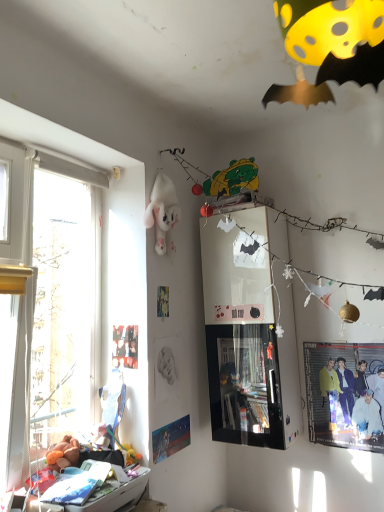
Describe the element at coordinates (64, 454) in the screenshot. This screenshot has height=512, width=384. I see `fluffy orange teddy bear at lower left, the 2th toy viewed from the back` at that location.

Measure the distance between matte black poster at upper left, which is counted as the first poster page, starting from the top, and camera.

matte black poster at upper left, which is counted as the first poster page, starting from the top, and camera are 6.56 feet apart from each other.

This screenshot has height=512, width=384. What do you see at coordinates (362, 399) in the screenshot?
I see `matte yellow jacket at lower right` at bounding box center [362, 399].

What is the approximate height of white plastic drawer at lower left?

7.18 inches.

Locate an element on the screen. The width and height of the screenshot is (384, 512). white plush toy at upper center, the second toy when ordered from left to right is located at coordinates (162, 210).

What do you see at coordinates (162, 210) in the screenshot? The image size is (384, 512). I see `white plush toy at upper center, which appears as the 1th toy when viewed from the top` at bounding box center [162, 210].

The height and width of the screenshot is (512, 384). What are the coordinates of `fluffy orange teddy bear at lower left, the 2th toy viewed from the back` in the screenshot? It's located at tap(64, 454).

Can you confirm if white plush toy at upper center, which ranks as the first toy in right-to-left order, is bigger than white plastic drawer at lower left?

Actually, white plush toy at upper center, which ranks as the first toy in right-to-left order, might be smaller than white plastic drawer at lower left.

Considering the sizes of objects white plush toy at upper center, which appears as the second toy when ordered from the bottom, and white plastic drawer at lower left in the image provided, who is thinner, white plush toy at upper center, which appears as the second toy when ordered from the bottom, or white plastic drawer at lower left?

With smaller width is white plush toy at upper center, which appears as the second toy when ordered from the bottom.

From a real-world perspective, is white plush toy at upper center, marked as the 2th toy in a front-to-back arrangement, positioned under white plastic drawer at lower left based on gravity?

Incorrect, from a real-world perspective, white plush toy at upper center, marked as the 2th toy in a front-to-back arrangement, is higher than white plastic drawer at lower left.

From their relative heights in the image, would you say white plush toy at upper center, the 1th toy from the back, is taller or shorter than white plastic drawer at lower left?

Considering their sizes, white plush toy at upper center, the 1th toy from the back, has more height than white plastic drawer at lower left.

From the image's perspective, relative to matte blue poster at lower left, the second poster page from the left, is white plastic drawer at lower left above or below?

Clearly, from the image's perspective, white plastic drawer at lower left is below matte blue poster at lower left, the second poster page from the left.

Which of these two, white plastic drawer at lower left or matte blue poster at lower left, the 1th poster page when ordered from bottom to top, stands shorter?

matte blue poster at lower left, the 1th poster page when ordered from bottom to top, is shorter.

This screenshot has height=512, width=384. Find the location of `furniture lying in front of the matte blue poster at lower left, which is the first poster page in right-to-left order`. furniture lying in front of the matte blue poster at lower left, which is the first poster page in right-to-left order is located at coordinates coord(116,495).

Is white plastic drawer at lower left thinner than matte blue poster at lower left, which is the first poster page in right-to-left order?

No, white plastic drawer at lower left is not thinner than matte blue poster at lower left, which is the first poster page in right-to-left order.

In the scene shown: Can we say fluffy orange teddy bear at lower left, the first toy positioned from the left, lies outside white plush toy at upper center, which appears as the second toy when ordered from the bottom?

Yes, fluffy orange teddy bear at lower left, the first toy positioned from the left, is located beyond the bounds of white plush toy at upper center, which appears as the second toy when ordered from the bottom.

Can you confirm if fluffy orange teddy bear at lower left, the first toy positioned from the left, is bigger than white plush toy at upper center, the 1th toy from the back?

Actually, fluffy orange teddy bear at lower left, the first toy positioned from the left, might be smaller than white plush toy at upper center, the 1th toy from the back.

Is fluffy orange teddy bear at lower left, the 1th toy when ordered from front to back, directly adjacent to white plush toy at upper center, which appears as the second toy when ordered from the bottom?

No.

From the image's perspective, which one is positioned higher, matte blue poster at lower left, the second poster page from the left, or white plush toy at upper center, the 1th toy from the back?

From the image's view, white plush toy at upper center, the 1th toy from the back, is above.

Is matte blue poster at lower left, the 1th poster page when ordered from bottom to top, oriented towards white plush toy at upper center, which appears as the 1th toy when viewed from the top?

No, matte blue poster at lower left, the 1th poster page when ordered from bottom to top, is not turned towards white plush toy at upper center, which appears as the 1th toy when viewed from the top.

Looking at this image, from a real-world perspective, is matte blue poster at lower left, the 1th poster page when ordered from bottom to top, physically located above or below white plush toy at upper center, which appears as the 1th toy when viewed from the top?

Clearly, from a real-world perspective, matte blue poster at lower left, the 1th poster page when ordered from bottom to top, is below white plush toy at upper center, which appears as the 1th toy when viewed from the top.

Is white plush toy at upper center, marked as the 2th toy in a front-to-back arrangement, located within matte blue poster at lower left, the 2th poster page when ordered from top to bottom?

No, white plush toy at upper center, marked as the 2th toy in a front-to-back arrangement, is not surrounded by matte blue poster at lower left, the 2th poster page when ordered from top to bottom.

Is fluffy orange teddy bear at lower left, the first toy positioned from the left, positioned beyond the bounds of matte black poster at upper left, the second poster page positioned from the right?

Yes, fluffy orange teddy bear at lower left, the first toy positioned from the left, is located beyond the bounds of matte black poster at upper left, the second poster page positioned from the right.

Is there a large distance between fluffy orange teddy bear at lower left, the 1th toy in the bottom-to-top sequence, and matte black poster at upper left, the first poster page from the left?

No, fluffy orange teddy bear at lower left, the 1th toy in the bottom-to-top sequence, is not far from matte black poster at upper left, the first poster page from the left.

You are a GUI agent. You are given a task and a screenshot of the screen. Output one action in this format:
    pyautogui.click(x=<x>, y=<y>)
    Task: Click on the toy that is below the matte black poster at upper left, which is counted as the first poster page, starting from the top (from the image's perspective)
    Image resolution: width=384 pixels, height=512 pixels.
    Given the screenshot: What is the action you would take?
    pyautogui.click(x=64, y=454)

Between fluffy orange teddy bear at lower left, which ranks as the second toy in top-to-bottom order, and matte black poster at upper left, the first poster page from the left, which one has less height?

With less height is fluffy orange teddy bear at lower left, which ranks as the second toy in top-to-bottom order.

Who is smaller, white plastic drawer at lower left or white plush toy at upper center, marked as the 2th toy in a front-to-back arrangement?

With smaller size is white plush toy at upper center, marked as the 2th toy in a front-to-back arrangement.

From a real-world perspective, between white plastic drawer at lower left and white plush toy at upper center, the 1th toy from the back, who is vertically higher?

From a 3D spatial view, white plush toy at upper center, the 1th toy from the back, is above.

Which of these two, white plastic drawer at lower left or white plush toy at upper center, marked as the 2th toy in a front-to-back arrangement, stands taller?

white plush toy at upper center, marked as the 2th toy in a front-to-back arrangement.

The image size is (384, 512). What are the coordinates of `furniture below the white plush toy at upper center, the second toy when ordered from left to right (from a real-world perspective)` in the screenshot? It's located at (116, 495).

Locate an element on the screen. The image size is (384, 512). toy that is above the matte yellow jacket at lower right (from the image's perspective) is located at coordinates tap(162, 210).

Considering the relative sizes of matte yellow jacket at lower right and white plush toy at upper center, which ranks as the first toy in right-to-left order, in the image provided, is matte yellow jacket at lower right wider than white plush toy at upper center, which ranks as the first toy in right-to-left order,?

No.

How different are the orientations of matte yellow jacket at lower right and white plush toy at upper center, marked as the 2th toy in a front-to-back arrangement, in degrees?

matte yellow jacket at lower right and white plush toy at upper center, marked as the 2th toy in a front-to-back arrangement, are facing 94.1 degrees away from each other.

Looking at this image, from the image's perspective, who appears lower, matte yellow jacket at lower right or white plush toy at upper center, marked as the 2th toy in a front-to-back arrangement?

matte yellow jacket at lower right.

The height and width of the screenshot is (512, 384). What are the coordinates of `furniture beneath the white plush toy at upper center, which appears as the second toy when ordered from the bottom (from a real-world perspective)` in the screenshot? It's located at (116, 495).

Locate an element on the screen. Image resolution: width=384 pixels, height=512 pixels. poster page that is the 1st object located above the white plastic drawer at lower left (from the image's perspective) is located at coordinates coord(170,439).

Considering their positions, is matte blue poster at lower left, the 1th poster page when ordered from bottom to top, positioned closer to matte yellow jacket at lower right than fluffy orange teddy bear at lower left, the second toy viewed from the right?

matte blue poster at lower left, the 1th poster page when ordered from bottom to top.

Looking at the image, which one is located closer to matte yellow jacket at lower right, fluffy orange teddy bear at lower left, the second toy viewed from the right, or white plastic drawer at lower left?

white plastic drawer at lower left is closer to matte yellow jacket at lower right.

From the image, which object appears to be nearer to white plastic drawer at lower left, fluffy orange teddy bear at lower left, which ranks as the second toy in top-to-bottom order, or matte yellow jacket at lower right?

The object closer to white plastic drawer at lower left is fluffy orange teddy bear at lower left, which ranks as the second toy in top-to-bottom order.

When comparing their distances from matte blue poster at lower left, which is the first poster page in right-to-left order, does matte yellow jacket at lower right or white plastic drawer at lower left seem further?

matte yellow jacket at lower right is further to matte blue poster at lower left, which is the first poster page in right-to-left order.

Considering their positions, is white plastic drawer at lower left positioned further to matte black poster at upper left, the first poster page from the left, than fluffy orange teddy bear at lower left, which ranks as the second toy in top-to-bottom order?

Among the two, white plastic drawer at lower left is located further to matte black poster at upper left, the first poster page from the left.

Which object lies nearer to the anchor point white plastic drawer at lower left, matte black poster at upper left, which is counted as the first poster page, starting from the top, or matte blue poster at lower left, which is the first poster page in right-to-left order?

Based on the image, matte blue poster at lower left, which is the first poster page in right-to-left order, appears to be nearer to white plastic drawer at lower left.

When comparing their distances from white plush toy at upper center, which appears as the 1th toy when viewed from the top, does matte black poster at upper left, the second poster page positioned from the right, or white plastic drawer at lower left seem closer?

matte black poster at upper left, the second poster page positioned from the right.

Considering their positions, is matte black poster at upper left, the second poster page positioned from the right, positioned closer to matte yellow jacket at lower right than fluffy orange teddy bear at lower left, the 1th toy when ordered from front to back?

matte black poster at upper left, the second poster page positioned from the right, lies closer to matte yellow jacket at lower right than the other object.

This screenshot has height=512, width=384. What are the coordinates of `poster page between white plush toy at upper center, marked as the 2th toy in a front-to-back arrangement, and matte blue poster at lower left, the 2th poster page when ordered from top to bottom, vertically` in the screenshot? It's located at (125, 346).

Where is `toy between matte black poster at upper left, the 2th poster page positioned from the bottom, and white plastic drawer at lower left in the up-down direction`? The width and height of the screenshot is (384, 512). toy between matte black poster at upper left, the 2th poster page positioned from the bottom, and white plastic drawer at lower left in the up-down direction is located at coordinates (64, 454).

Locate an element on the screen. toy between white plush toy at upper center, the 1th toy from the back, and matte blue poster at lower left, which is the first poster page in right-to-left order, vertically is located at coordinates [64, 454].

Find the location of `toy situated between fluffy orange teddy bear at lower left, the first toy positioned from the left, and matte yellow jacket at lower right from left to right`. toy situated between fluffy orange teddy bear at lower left, the first toy positioned from the left, and matte yellow jacket at lower right from left to right is located at coordinates (162, 210).